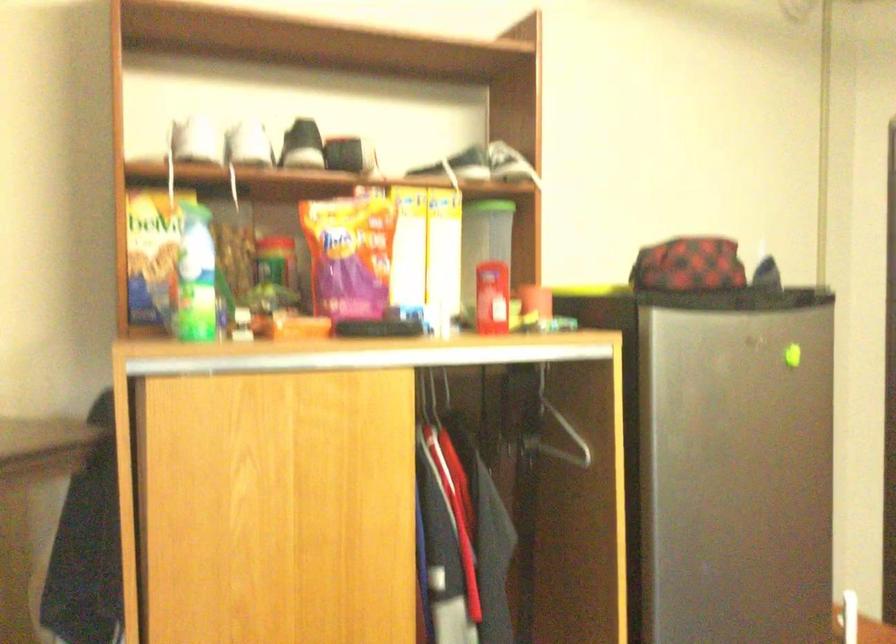
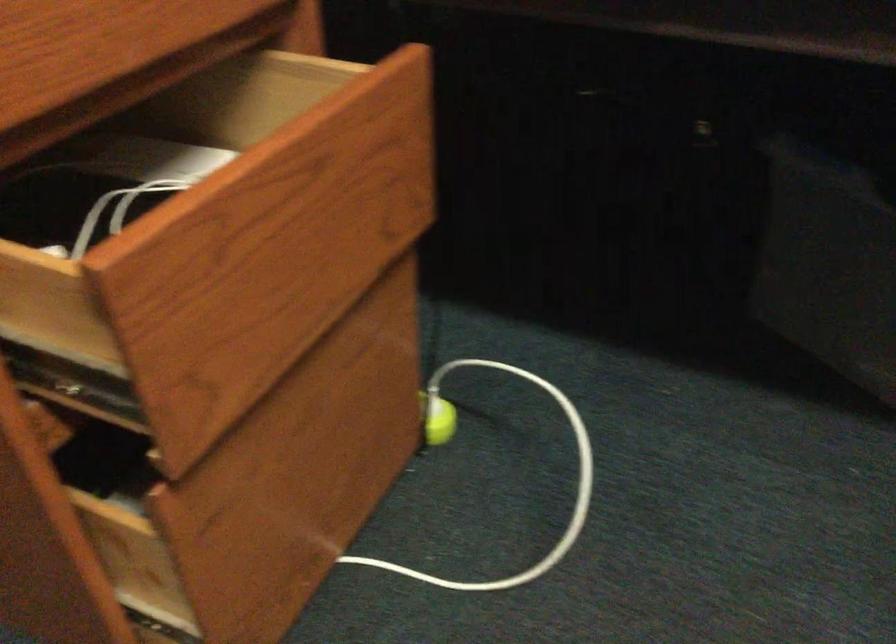
Based on the photo, based on the continuous images, in which direction is the camera rotating?

The camera rotated toward left-down.